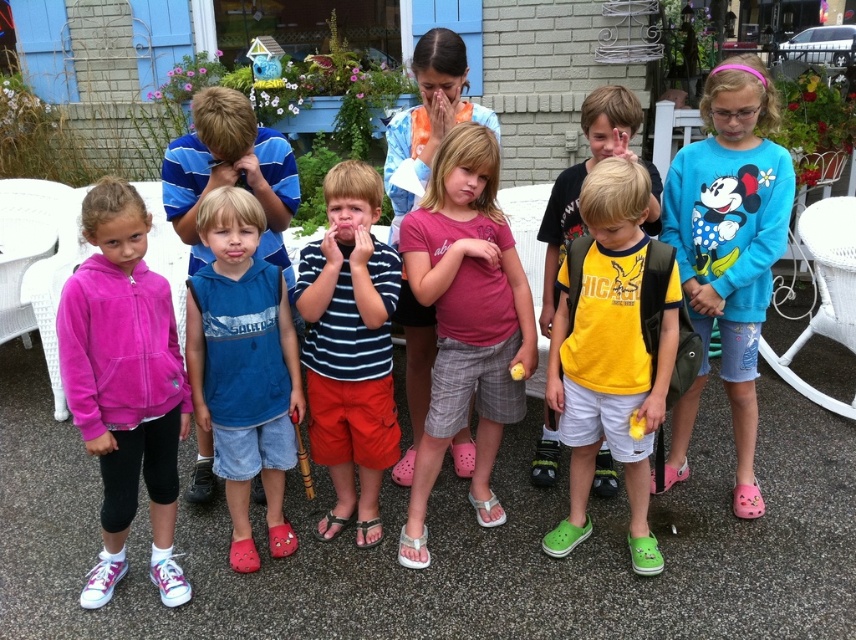
Question: Considering the real-world distances, which object is closest to the pink cotton shirt at center?

Choices:
 (A) pink fleece hoodie at left
 (B) blue cotton hoodie at center
 (C) blue cotton sweatshirt at center

Answer: (B)

Question: Can you confirm if pink cotton shirt at center is positioned to the left of striped cotton shirt at center?

Choices:
 (A) yes
 (B) no

Answer: (B)

Question: Can you confirm if pink fleece hoodie at left is positioned to the left of yellow matte t-shirt at center?

Choices:
 (A) no
 (B) yes

Answer: (B)

Question: Is blue cotton hoodie at center thinner than striped cotton shirt at center?

Choices:
 (A) no
 (B) yes

Answer: (B)

Question: Which point is farther to the camera?

Choices:
 (A) (226, 380)
 (B) (596, 230)
 (C) (373, 420)
 (D) (70, 378)

Answer: (C)

Question: Which object is the closest to the striped cotton shirt at center?

Choices:
 (A) blue cotton hoodie at center
 (B) pink cotton shirt at center

Answer: (A)